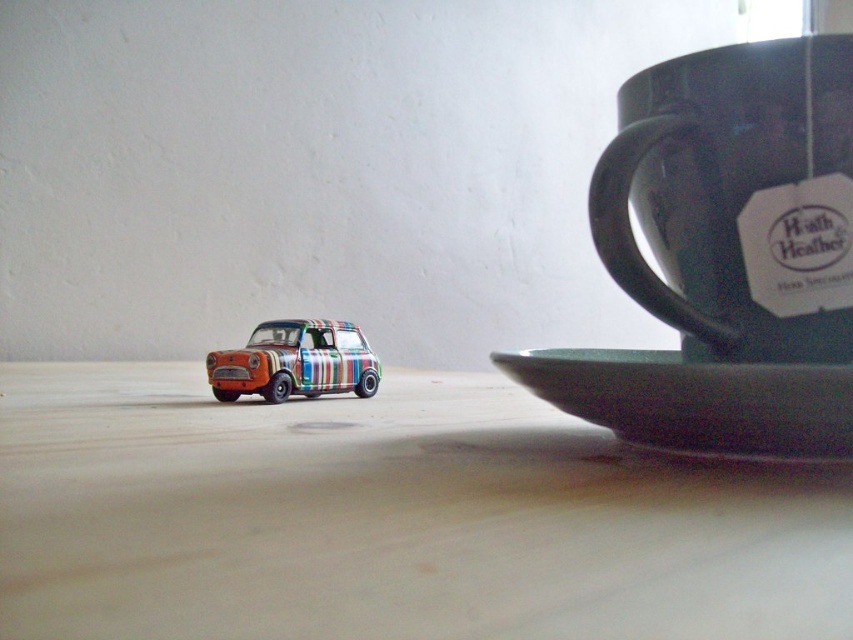
Question: Does wooden table at center appear on the right side of matte dark green mug at upper right?

Choices:
 (A) yes
 (B) no

Answer: (B)

Question: Which of the following is the closest to the observer?

Choices:
 (A) (676, 416)
 (B) (363, 381)
 (C) (668, 316)

Answer: (A)

Question: Considering the real-world distances, which object is farthest from the green matte saucer at lower right?

Choices:
 (A) multicolored striped car at lower left
 (B) wooden table at center

Answer: (A)

Question: From the image, what is the correct spatial relationship of wooden table at center in relation to matte dark green mug at upper right?

Choices:
 (A) below
 (B) above

Answer: (A)

Question: Among these points, which one is farthest from the camera?

Choices:
 (A) (631, 246)
 (B) (6, 364)
 (C) (289, 339)

Answer: (B)

Question: Is wooden table at center bigger than green matte saucer at lower right?

Choices:
 (A) no
 (B) yes

Answer: (B)